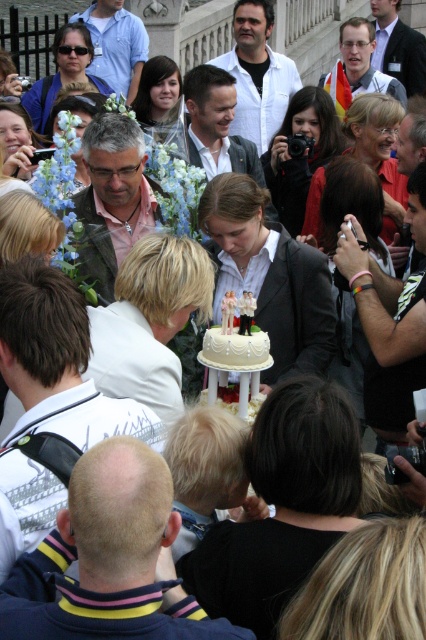
Is white matte shirt at center smaller than white fondant cake at center?

Incorrect, white matte shirt at center is not smaller in size than white fondant cake at center.

In the scene shown: Who is positioned more to the right, white matte shirt at center or white fondant cake at center?

Positioned to the right is white matte shirt at center.

Which is in front, point (282, 81) or point (255, 348)?

Point (255, 348)

Where is `white matte shirt at center`? The height and width of the screenshot is (640, 426). white matte shirt at center is located at coordinates (258, 74).

Is white matte shirt at center thinner than matte black suit at center?

In fact, white matte shirt at center might be wider than matte black suit at center.

Is point (270, 88) behind point (419, 76)?

No, (270, 88) is closer to viewer.

I want to click on white matte shirt at center, so click(258, 74).

Does matte pink shirt at center appear over smooth gray suit at center?

Incorrect, matte pink shirt at center is not positioned above smooth gray suit at center.

Can you confirm if matte pink shirt at center is wider than smooth gray suit at center?

In fact, matte pink shirt at center might be narrower than smooth gray suit at center.

Is point (97, 129) in front of point (213, 83)?

Yes, point (97, 129) is closer to viewer.

Where is `matte pink shirt at center`? The width and height of the screenshot is (426, 640). matte pink shirt at center is located at coordinates (112, 198).